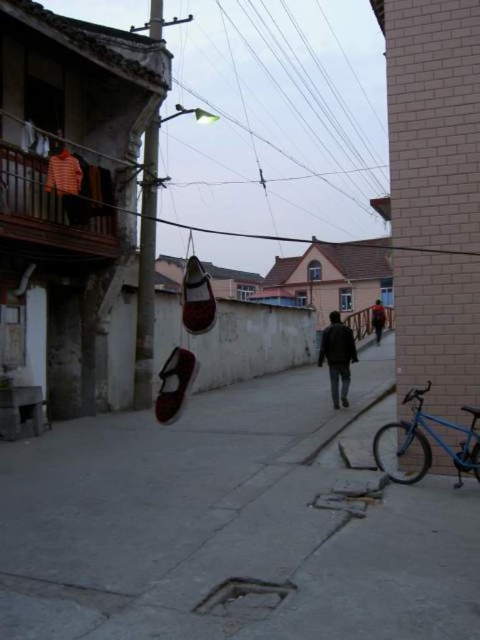
Question: Which point is closer to the camera?

Choices:
 (A) dark brown leather jacket at center
 (B) concrete sidewalk at center
 (C) blue matte bicycle at lower right

Answer: (B)

Question: Does concrete sidewalk at center have a greater width compared to blue matte bicycle at lower right?

Choices:
 (A) no
 (B) yes

Answer: (B)

Question: Which object appears closest to the camera in this image?

Choices:
 (A) dark blue jeans at center
 (B) dark brown leather jacket at center

Answer: (A)

Question: Can you confirm if concrete sidewalk at center is wider than dark blue jeans at center?

Choices:
 (A) yes
 (B) no

Answer: (A)

Question: Among these points, which one is farthest from the camera?

Choices:
 (A) (376, 333)
 (B) (455, 428)
 (C) (339, 371)

Answer: (A)

Question: Can you confirm if concrete sidewalk at center is bigger than blue matte bicycle at lower right?

Choices:
 (A) yes
 (B) no

Answer: (A)